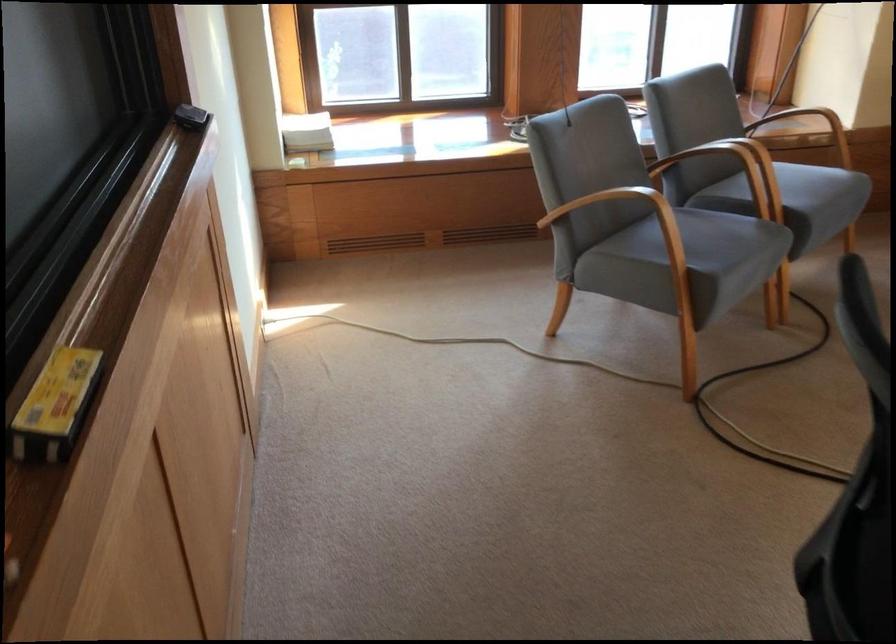
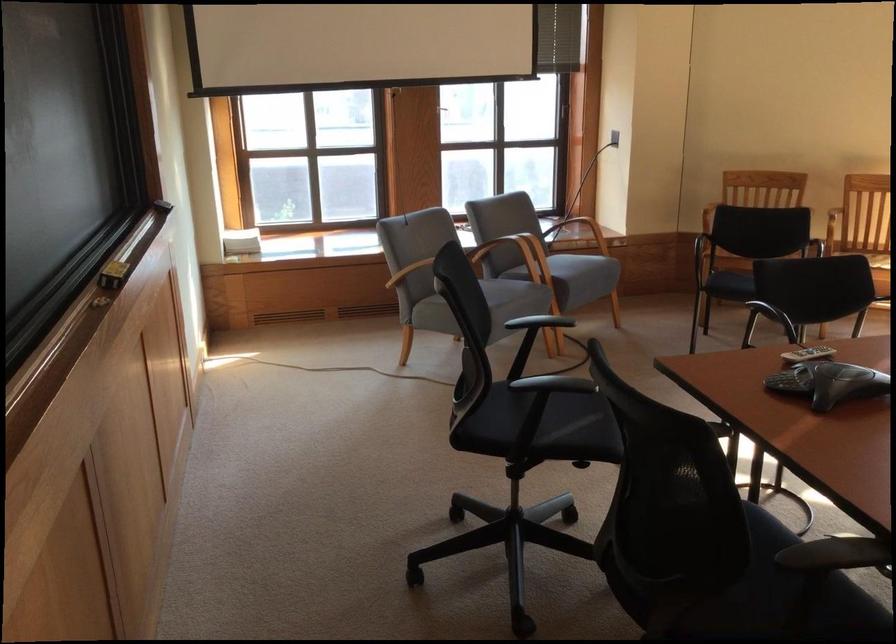
Question: The images are taken continuously from a first-person perspective. In which direction are you moving?

Choices:
 (A) Left
 (B) Right
 (C) Forward
 (D) Backward

Answer: (D)